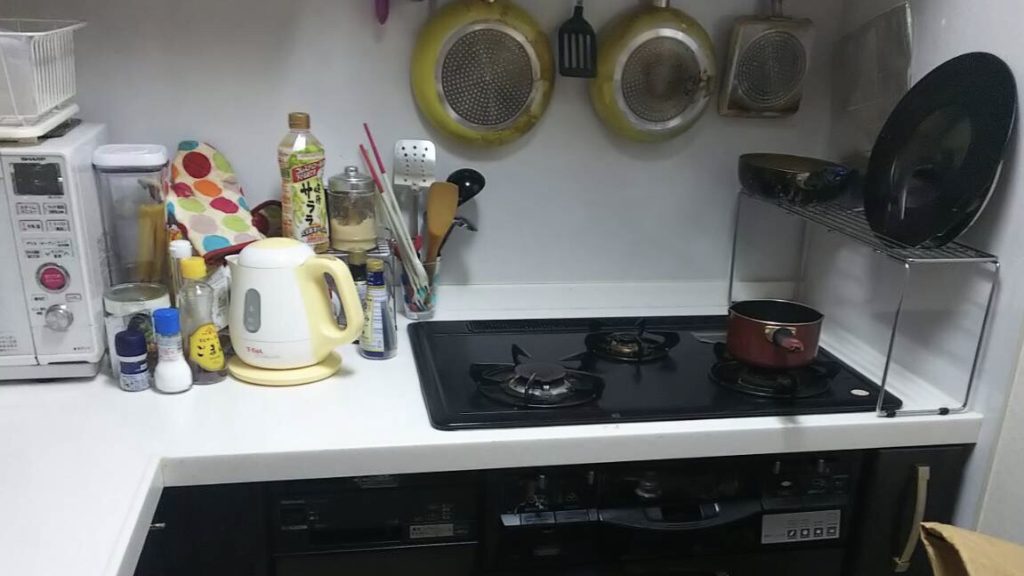
Find the location of a particular element. This screenshot has width=1024, height=576. bottom left burner is located at coordinates (545, 378).